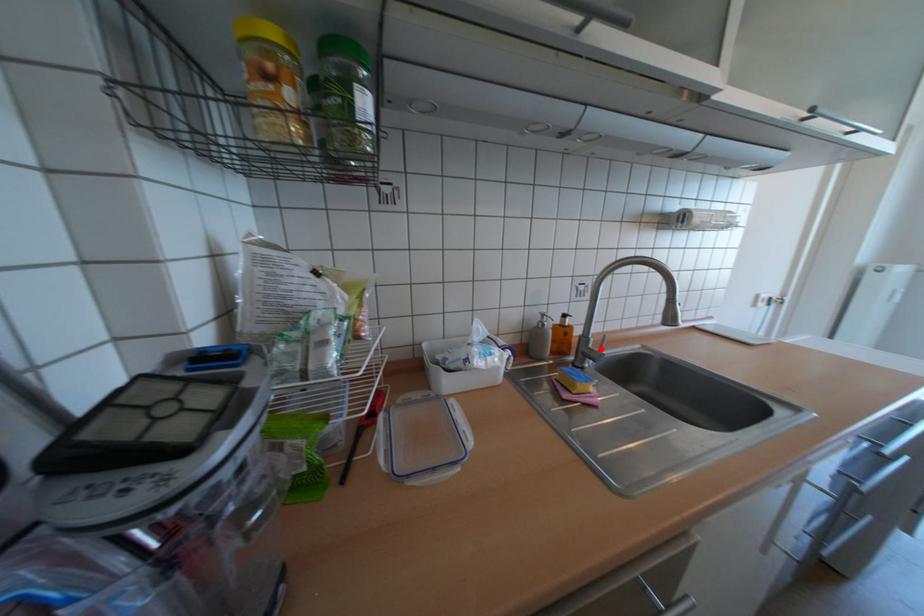
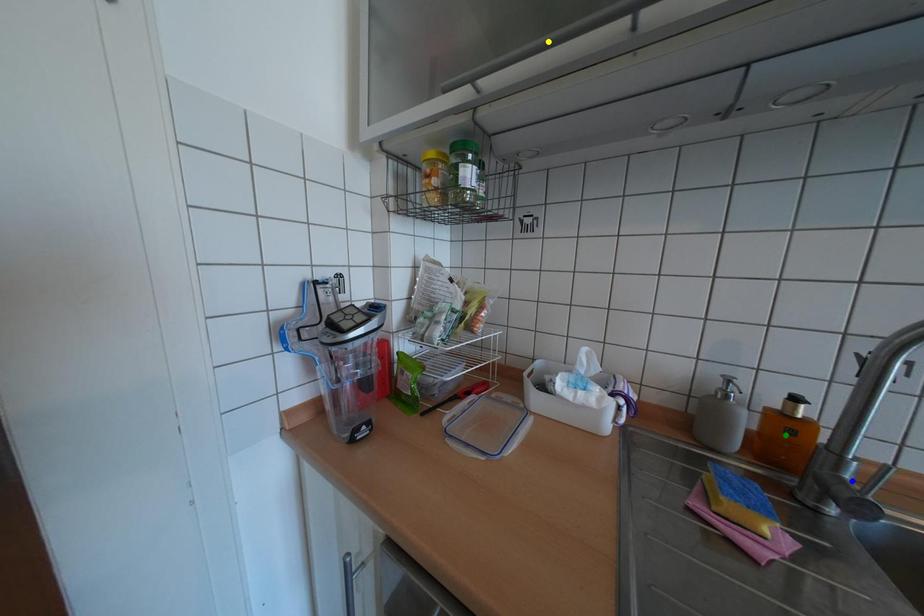
Question: I am providing you with two images of the same scene from different viewpoints. A red point is marked on the first image. You are given multiple points on the second image. Can you choose the point in image 2 that corresponds to the point in image 1?

Choices:
 (A) green point
 (B) blue point
 (C) yellow point

Answer: (B)